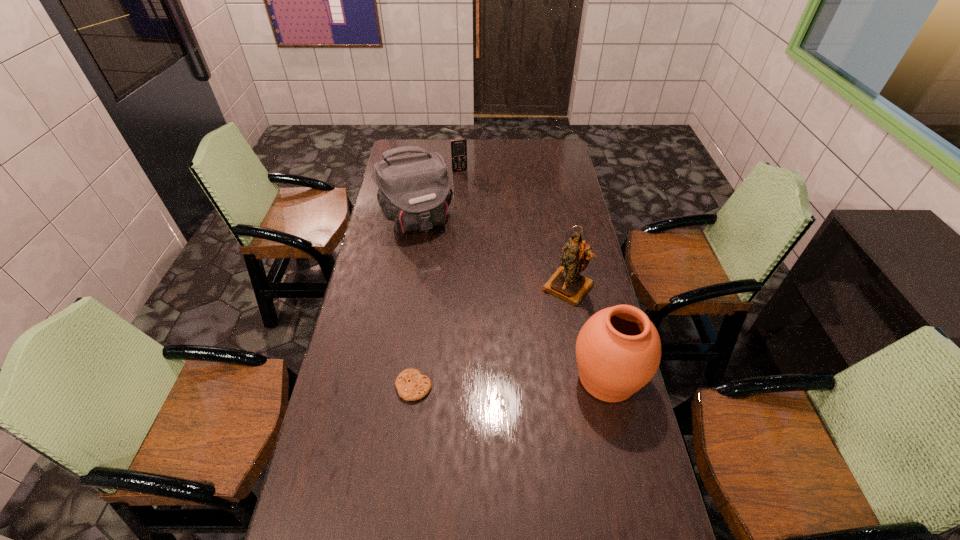
The image size is (960, 540). I want to click on cookie, so click(411, 385).

Image resolution: width=960 pixels, height=540 pixels. I want to click on urn, so click(618, 350).

At what (x,y) coordinates should I click in order to perform the action: click on figurine. Please return your answer as a coordinate pair (x, y). Looking at the image, I should click on (566, 283).

The width and height of the screenshot is (960, 540). Identify the location of the tallest object. (414, 191).

Locate an element on the screen. The image size is (960, 540). the fourth nearest object is located at coordinates (414, 191).

In order to click on the fourth tallest object in this screenshot , I will do `click(458, 146)`.

You are a GUI agent. You are given a task and a screenshot of the screen. Output one action in this format:
    pyautogui.click(x=<x>, y=<y>)
    Task: Click on the cellular telephone
    This screenshot has width=960, height=540.
    Given the screenshot: What is the action you would take?
    pyautogui.click(x=458, y=146)

Identify the location of blank space located 0.290m on the right of the shortest object. The image size is (960, 540). (528, 387).

Where is `vacant area located on the back of the urn`? vacant area located on the back of the urn is located at coordinates (595, 327).

Locate an element on the screen. The height and width of the screenshot is (540, 960). vacant region located on the front-facing side of the figurine is located at coordinates (540, 320).